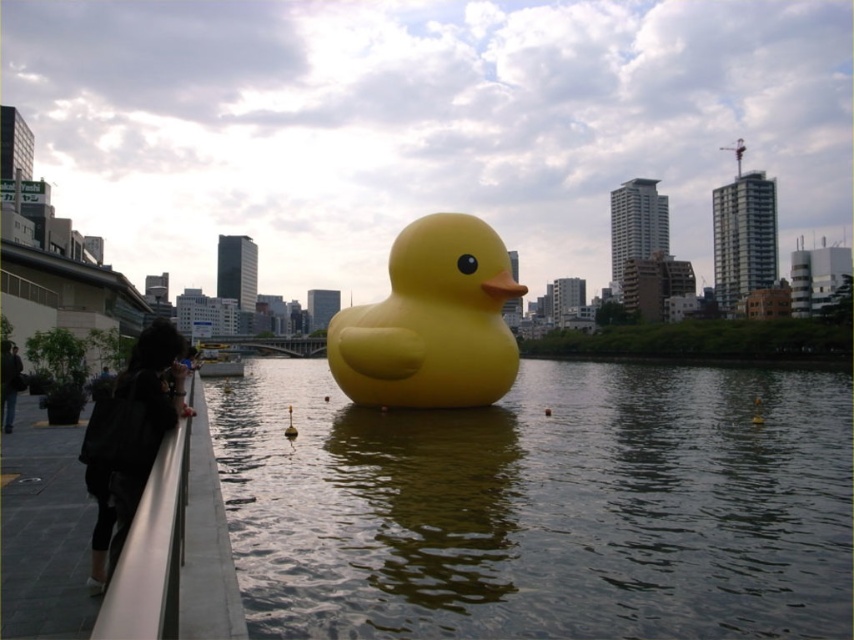
Does smooth water at center come behind yellow rubber duck at center?

No, it is not.

The image size is (854, 640). Describe the element at coordinates (542, 506) in the screenshot. I see `smooth water at center` at that location.

Identify the location of smooth water at center. (542, 506).

Is point (410, 337) less distant than point (10, 426)?

No, (410, 337) is further to viewer.

Is yellow rubber duck at center wider than dark gray jacket at lower left?

Yes, yellow rubber duck at center is wider than dark gray jacket at lower left.

Does point (442, 257) lie in front of point (13, 387)?

No.

This screenshot has width=854, height=640. I want to click on yellow rubber duck at center, so click(x=431, y=321).

Who is taller, black fabric jacket at lower left or dark gray jacket at lower left?

Standing taller between the two is black fabric jacket at lower left.

Which is more to the left, black fabric jacket at lower left or dark gray jacket at lower left?

dark gray jacket at lower left

You are a GUI agent. You are given a task and a screenshot of the screen. Output one action in this format:
    pyautogui.click(x=<x>, y=<y>)
    Task: Click on the black fabric jacket at lower left
    
    Given the screenshot: What is the action you would take?
    pyautogui.click(x=132, y=435)

Find the location of `black fabric jacket at lower left`. black fabric jacket at lower left is located at coordinates (132, 435).